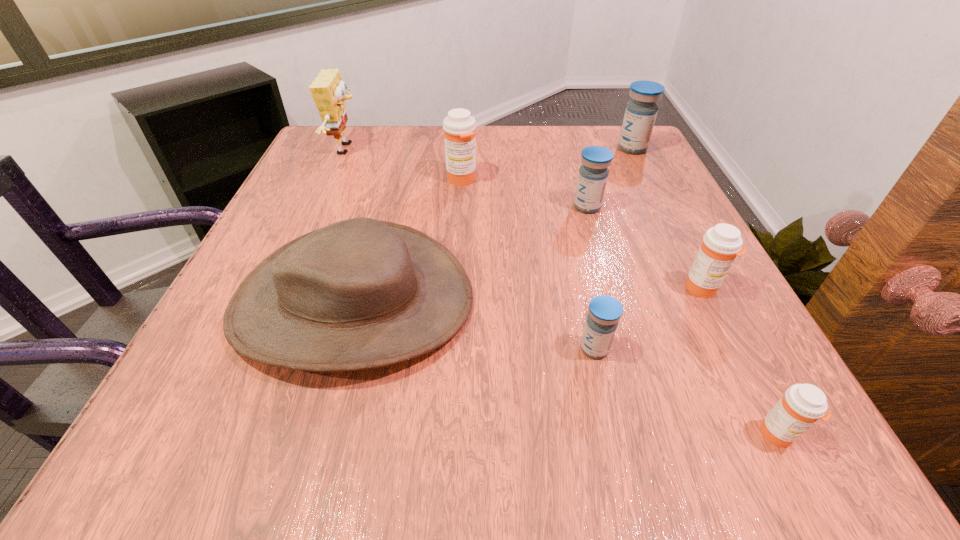
This screenshot has height=540, width=960. I want to click on the second nearest medicine, so 605,311.

You are a GUI agent. You are given a task and a screenshot of the screen. Output one action in this format:
    pyautogui.click(x=<x>, y=<y>)
    Task: Click on the nearest blue medicine
    This screenshot has height=540, width=960.
    Given the screenshot: What is the action you would take?
    click(x=605, y=311)

At what (x,y) coordinates should I click in order to perform the action: click on the smallest orange medicine. Please return your answer as a coordinate pair (x, y). The width and height of the screenshot is (960, 540). Looking at the image, I should click on (802, 405).

What are the coordinates of `the nearest object` in the screenshot? It's located at (802, 405).

Identify the location of vacant space located on the face of the sponge. The image size is (960, 540). (388, 149).

Locate an element on the screen. Image resolution: width=960 pixels, height=540 pixels. vacant space located on the left of the farthest medicine is located at coordinates (527, 148).

The image size is (960, 540). I want to click on free space located on the front of the leftmost medicine, so click(457, 253).

Where is `free region located 0.280m on the back of the second farthest blue medicine`? This screenshot has width=960, height=540. free region located 0.280m on the back of the second farthest blue medicine is located at coordinates (566, 136).

This screenshot has height=540, width=960. I want to click on vacant region located 0.180m on the front of the fourth farthest medicine, so click(760, 401).

The width and height of the screenshot is (960, 540). I want to click on vacant space located on the back of the brown cowboy hat, so click(x=398, y=140).